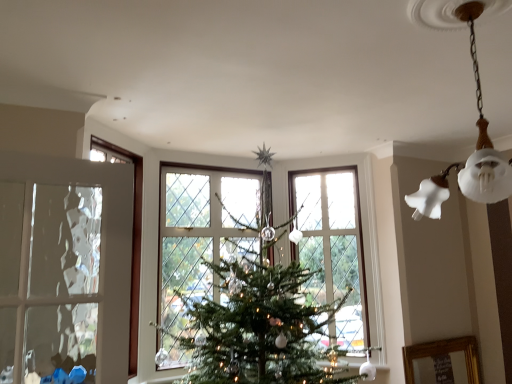
Question: Is white frosted glass bell at upper right far from clear glass window at center?

Choices:
 (A) no
 (B) yes

Answer: (B)

Question: Does white frosted glass bell at upper right have a lesser width compared to clear glass window at center?

Choices:
 (A) no
 (B) yes

Answer: (A)

Question: Does white frosted glass bell at upper right have a lesser height compared to clear glass window at center?

Choices:
 (A) yes
 (B) no

Answer: (A)

Question: Does white frosted glass bell at upper right have a greater height compared to clear glass window at center?

Choices:
 (A) yes
 (B) no

Answer: (B)

Question: From a real-world perspective, is white frosted glass bell at upper right on clear glass window at center?

Choices:
 (A) yes
 (B) no

Answer: (A)

Question: Does white frosted glass bell at upper right lie behind clear glass window at center?

Choices:
 (A) yes
 (B) no

Answer: (B)

Question: From the image's perspective, does clear glass window at center appear lower than white frosted glass bell at upper right?

Choices:
 (A) no
 (B) yes

Answer: (B)

Question: Can you confirm if clear glass window at center is bigger than white frosted glass bell at upper right?

Choices:
 (A) yes
 (B) no

Answer: (B)

Question: From a real-world perspective, is clear glass window at center over white frosted glass bell at upper right?

Choices:
 (A) no
 (B) yes

Answer: (A)

Question: Is white frosted glass bell at upper right a part of clear glass window at center?

Choices:
 (A) no
 (B) yes

Answer: (A)

Question: Is clear glass window at center positioned far away from white frosted glass bell at upper right?

Choices:
 (A) no
 (B) yes

Answer: (B)

Question: Can we say clear glass window at center lies outside white frosted glass bell at upper right?

Choices:
 (A) yes
 (B) no

Answer: (A)

Question: From a real-world perspective, is white frosted glass bell at upper right positioned above or below clear glass window at center?

Choices:
 (A) below
 (B) above

Answer: (B)